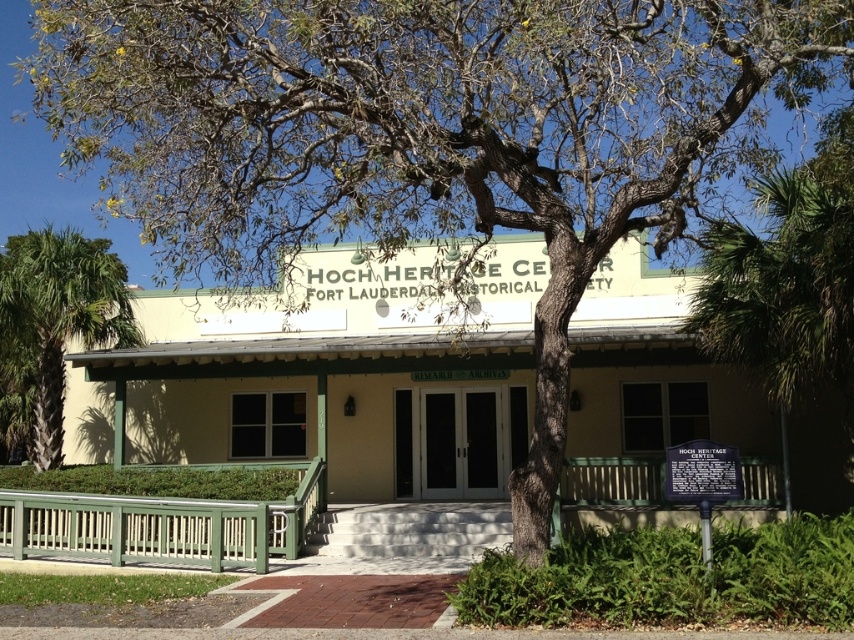
You are a visitor at the Hoch Heritage Center. You notice two trees outside the building. Which tree is closer to the entrance? The entrance has double doors labeled Research Archives. The trees are the green leafy tree at right and the green leafy palm tree at lower left. Based on their sizes, can you determine which is closer?

The green leafy tree at right is smaller than the green leafy palm tree at lower left. Since smaller objects can sometimes appear closer or farther depending on actual distance and size, but given that the green leafy palm tree at lower left is larger in reality, it might be positioned farther away to appear smaller, but this is speculative. Without explicit distance data, we cannot definitively determine closeness based solely on size.

You are a visitor at the Hoch Heritage Center and want to place a small decorative pot on the green wooden porch at center. The pot is as wide as the metallic plaque at center. Will the pot fit on the porch without overhanging?

The green wooden porch at center is wider than the metallic plaque at center. Since the pot is as wide as the plaque, it will fit on the porch without overhanging.

You are a visitor at the Hoch Heritage Center and want to locate the entrance. You see a green leafy tree at right and a metallic plaque at center. Which object is closer to the entrance?

The metallic plaque at center is closer to the entrance because the green leafy tree at right is to the right of the metallic plaque at center, meaning the plaque is positioned between the tree and the entrance.